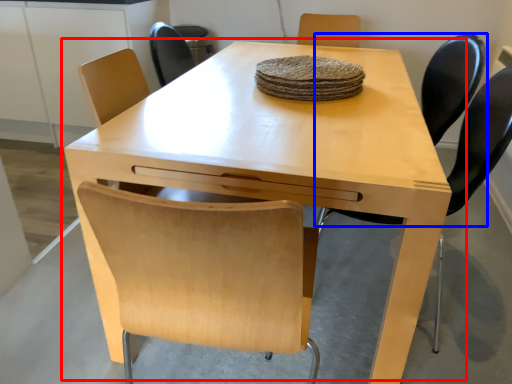
Question: Which of the following is the farthest to the observer, table (highlighted by a red box) or chair (highlighted by a blue box)?

Choices:
 (A) table
 (B) chair

Answer: (B)